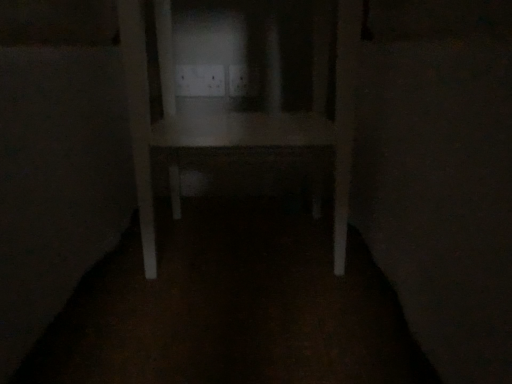
Question: From the image's perspective, is white plastic electric outlet at center, positioned as the second electric outlet in left-to-right order, on top of white plastic electric outlet at center, the 2th electric outlet in the right-to-left sequence?

Choices:
 (A) no
 (B) yes

Answer: (B)

Question: Can you confirm if white plastic electric outlet at center, positioned as the second electric outlet in left-to-right order, is shorter than white plastic electric outlet at center, the 2th electric outlet in the right-to-left sequence?

Choices:
 (A) yes
 (B) no

Answer: (B)

Question: From the image's perspective, is white plastic electric outlet at center, positioned as the second electric outlet in left-to-right order, beneath white plastic electric outlet at center, which is the 1th electric outlet in left-to-right order?

Choices:
 (A) yes
 (B) no

Answer: (B)

Question: Considering the relative positions of white plastic electric outlet at center, positioned as the second electric outlet in left-to-right order, and white plastic electric outlet at center, which is the 1th electric outlet in left-to-right order, in the image provided, is white plastic electric outlet at center, positioned as the second electric outlet in left-to-right order, to the right of white plastic electric outlet at center, which is the 1th electric outlet in left-to-right order, from the viewer's perspective?

Choices:
 (A) yes
 (B) no

Answer: (A)

Question: Is white plastic electric outlet at center, which appears as the first electric outlet when viewed from the right, at the left side of white plastic electric outlet at center, the 2th electric outlet in the right-to-left sequence?

Choices:
 (A) no
 (B) yes

Answer: (A)

Question: Is white matte table at center inside the boundaries of white plastic electric outlet at center, the 2th electric outlet in the right-to-left sequence, or outside?

Choices:
 (A) inside
 (B) outside

Answer: (B)

Question: From the image's perspective, is white matte table at center located above or below white plastic electric outlet at center, the 2th electric outlet in the right-to-left sequence?

Choices:
 (A) below
 (B) above

Answer: (A)

Question: Considering their positions, is white matte table at center located in front of or behind white plastic electric outlet at center, the 2th electric outlet in the right-to-left sequence?

Choices:
 (A) behind
 (B) front

Answer: (B)

Question: Considering the positions of white matte table at center and white plastic electric outlet at center, the 2th electric outlet in the right-to-left sequence, in the image, is white matte table at center bigger or smaller than white plastic electric outlet at center, the 2th electric outlet in the right-to-left sequence,?

Choices:
 (A) small
 (B) big

Answer: (B)

Question: Is white matte table at center spatially inside white plastic electric outlet at center, positioned as the second electric outlet in left-to-right order, or outside of it?

Choices:
 (A) outside
 (B) inside

Answer: (A)

Question: Based on their positions, is white matte table at center located to the left or right of white plastic electric outlet at center, which appears as the first electric outlet when viewed from the right?

Choices:
 (A) right
 (B) left

Answer: (B)

Question: Is point (141, 72) positioned closer to the camera than point (232, 92)?

Choices:
 (A) farther
 (B) closer

Answer: (B)

Question: From the image's perspective, is white matte table at center positioned above or below white plastic electric outlet at center, positioned as the second electric outlet in left-to-right order?

Choices:
 (A) below
 (B) above

Answer: (A)

Question: Considering the positions of point (258, 81) and point (218, 71), is point (258, 81) closer or farther from the camera than point (218, 71)?

Choices:
 (A) closer
 (B) farther

Answer: (B)

Question: In terms of height, does white plastic electric outlet at center, which appears as the first electric outlet when viewed from the right, look taller or shorter compared to white plastic electric outlet at center, the 2th electric outlet in the right-to-left sequence?

Choices:
 (A) short
 (B) tall

Answer: (A)